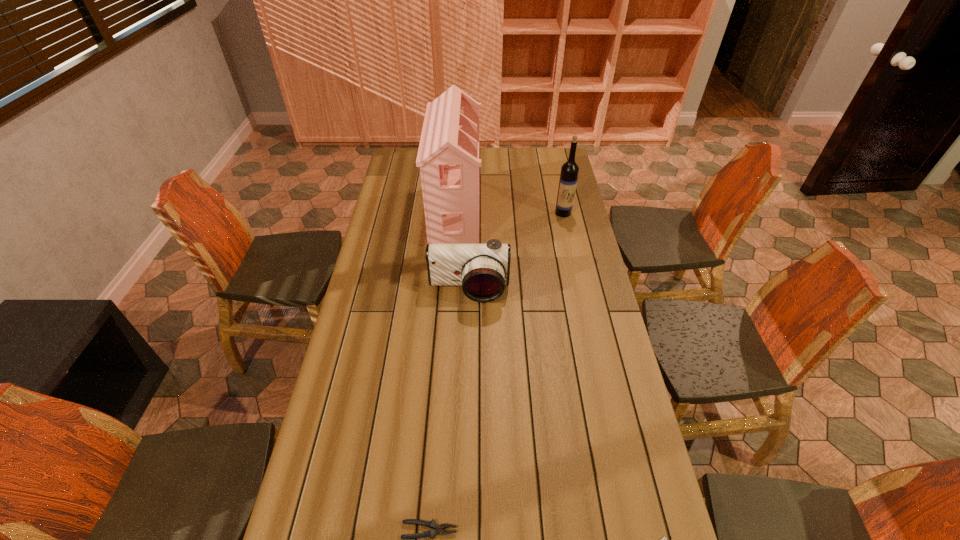
Image resolution: width=960 pixels, height=540 pixels. In the image, there is a desktop. Find the location of `vacant space at the right edge`. vacant space at the right edge is located at coordinates (574, 215).

Identify which object is the closest to the shortest object. Please provide its 2D coordinates. Your answer should be formatted as a tuple, i.e. [(x, y)], where the tuple contains the x and y coordinates of a point satisfying the conditions above.

[(432, 524)]

Find the location of a particular element. The image size is (960, 540). object that ranks as the closest to the left pliers is located at coordinates (662, 539).

At what (x,y) coordinates should I click in order to perform the action: click on pliers object that ranks as the closest to the camcorder. Please return your answer as a coordinate pair (x, y). Looking at the image, I should click on (432, 524).